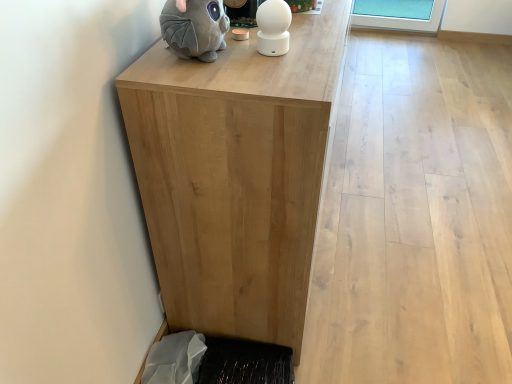
Question: Is gray plush toy at upper left not close to natural wood table at center?

Choices:
 (A) no
 (B) yes

Answer: (A)

Question: Does gray plush toy at upper left turn towards natural wood table at center?

Choices:
 (A) yes
 (B) no

Answer: (B)

Question: Is gray plush toy at upper left to the left of natural wood table at center from the viewer's perspective?

Choices:
 (A) yes
 (B) no

Answer: (A)

Question: Is the position of gray plush toy at upper left more distant than that of natural wood table at center?

Choices:
 (A) yes
 (B) no

Answer: (A)

Question: Considering the relative sizes of gray plush toy at upper left and natural wood table at center in the image provided, is gray plush toy at upper left taller than natural wood table at center?

Choices:
 (A) no
 (B) yes

Answer: (A)

Question: Is the depth of gray plush toy at upper left less than that of natural wood table at center?

Choices:
 (A) yes
 (B) no

Answer: (B)

Question: From a real-world perspective, is black textured mat at lower left under gray plush toy at upper left?

Choices:
 (A) yes
 (B) no

Answer: (A)

Question: Is black textured mat at lower left wider than gray plush toy at upper left?

Choices:
 (A) yes
 (B) no

Answer: (A)

Question: Is black textured mat at lower left bigger than gray plush toy at upper left?

Choices:
 (A) no
 (B) yes

Answer: (B)

Question: From the image's perspective, is black textured mat at lower left below gray plush toy at upper left?

Choices:
 (A) yes
 (B) no

Answer: (A)

Question: Is black textured mat at lower left at the left side of gray plush toy at upper left?

Choices:
 (A) no
 (B) yes

Answer: (A)

Question: Considering the relative sizes of black textured mat at lower left and gray plush toy at upper left in the image provided, is black textured mat at lower left shorter than gray plush toy at upper left?

Choices:
 (A) no
 (B) yes

Answer: (B)

Question: From a real-world perspective, does black textured mat at lower left sit lower than natural wood table at center?

Choices:
 (A) yes
 (B) no

Answer: (A)